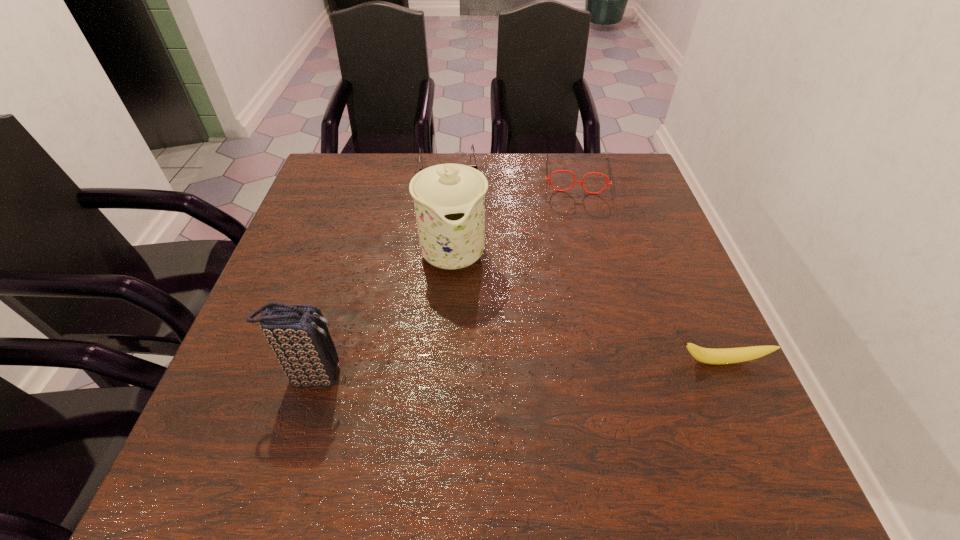
The width and height of the screenshot is (960, 540). In the image, there is a desktop. Find the location of `free space at the near left corner`. free space at the near left corner is located at coordinates (304, 399).

Where is `vacant area at the far right corner of the desktop`? vacant area at the far right corner of the desktop is located at coordinates (645, 181).

Identify the location of vacant space in between the spectacles and the banana. (649, 268).

The height and width of the screenshot is (540, 960). I want to click on vacant region between the clutch bag and the spectacles, so click(444, 275).

Where is `unoccupied area between the chinaware and the spectacles`? unoccupied area between the chinaware and the spectacles is located at coordinates (515, 213).

I want to click on free spot between the chinaware and the banana, so click(x=588, y=306).

This screenshot has width=960, height=540. In order to click on free space between the third farthest object and the banana in this screenshot , I will do `click(588, 306)`.

The height and width of the screenshot is (540, 960). Identify the location of empty space between the chinaware and the leftmost object. (383, 313).

Image resolution: width=960 pixels, height=540 pixels. I want to click on empty space between the spectacles and the third nearest object, so click(x=515, y=213).

Find the location of a particular element. This screenshot has width=960, height=540. free area in between the banana and the spectacles is located at coordinates (649, 268).